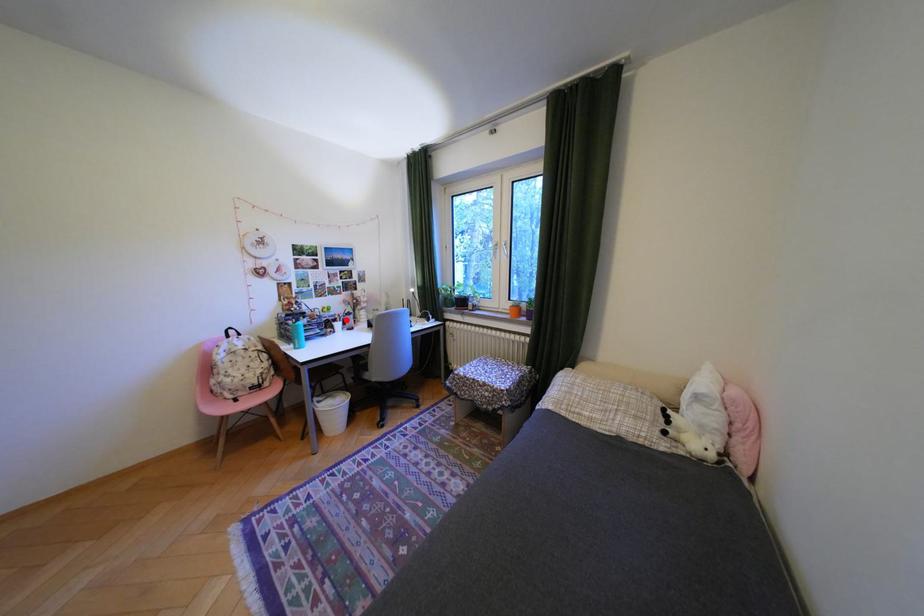
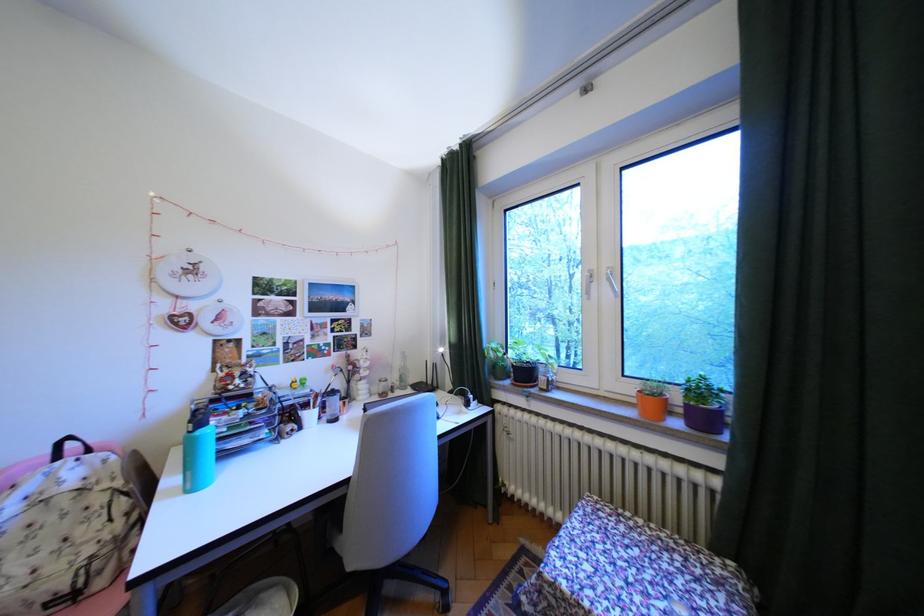
In the second image, find the point that corresponds to the highlighted location in the first image.

(318, 406)